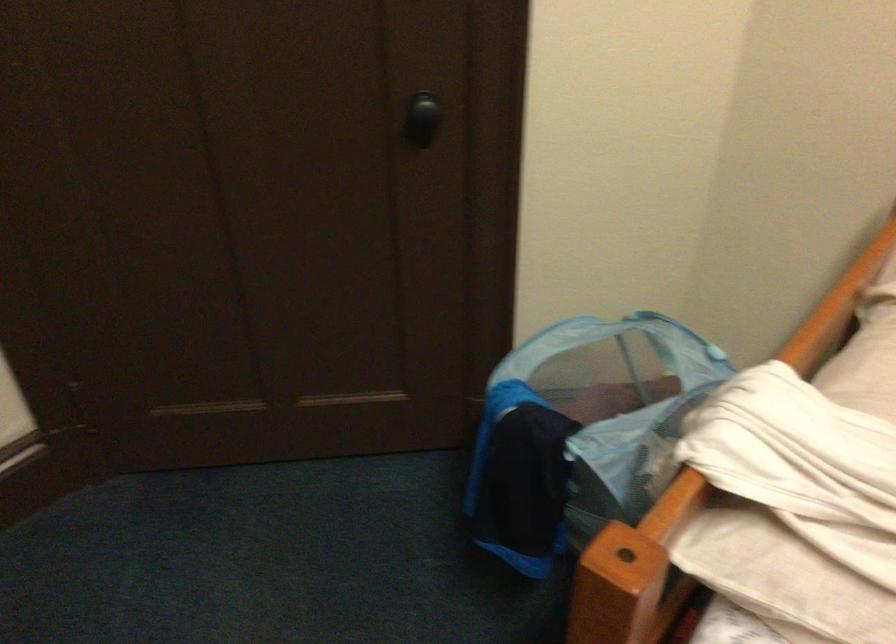
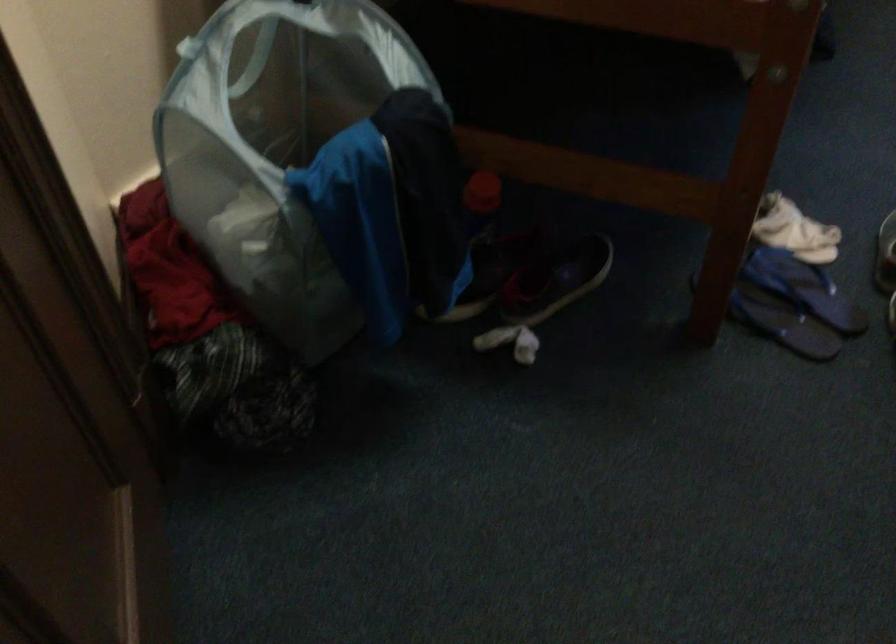
Where in the second image is the point corresponding to the point at 638,312 from the first image?

(186, 46)